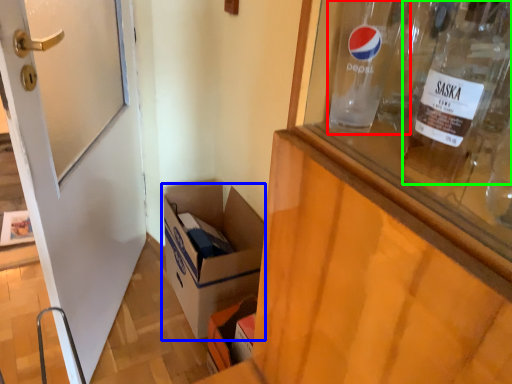
Question: Which object is positioned closest to glass bottle (highlighted by a red box)? Select from box (highlighted by a blue box) and bottle (highlighted by a green box).

Choices:
 (A) box
 (B) bottle

Answer: (B)